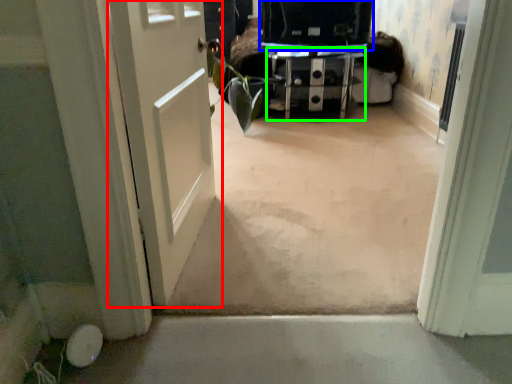
Question: Which object is positioned farthest from door (highlighted by a red box)? Select from back (highlighted by a blue box) and furniture (highlighted by a green box).

Choices:
 (A) back
 (B) furniture

Answer: (B)